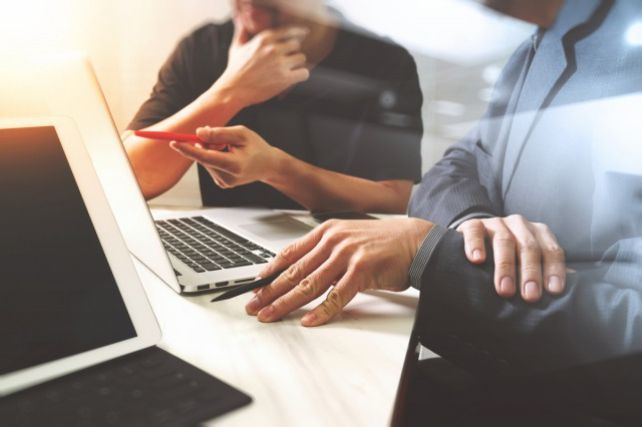
Locate an element on the screen. Image resolution: width=642 pixels, height=427 pixels. keyboards is located at coordinates coord(135,398), coord(217,243).